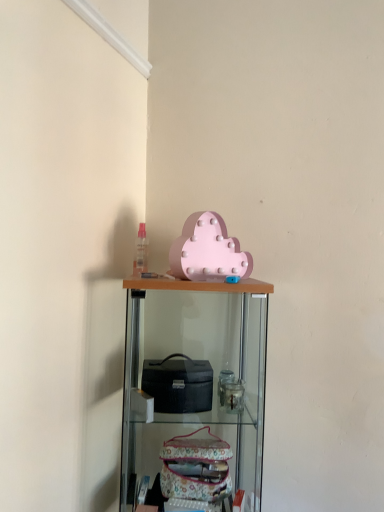
Question: Considering the relative positions of wooden shelf at center and matte pink cloud at upper center in the image provided, is wooden shelf at center to the right of matte pink cloud at upper center from the viewer's perspective?

Choices:
 (A) no
 (B) yes

Answer: (A)

Question: Is wooden shelf at center in contact with matte pink cloud at upper center?

Choices:
 (A) yes
 (B) no

Answer: (B)

Question: From a real-world perspective, is wooden shelf at center below matte pink cloud at upper center?

Choices:
 (A) no
 (B) yes

Answer: (B)

Question: Does wooden shelf at center have a larger size compared to matte pink cloud at upper center?

Choices:
 (A) no
 (B) yes

Answer: (B)

Question: From the image's perspective, is wooden shelf at center located beneath matte pink cloud at upper center?

Choices:
 (A) yes
 (B) no

Answer: (A)

Question: Does wooden shelf at center turn towards matte pink cloud at upper center?

Choices:
 (A) yes
 (B) no

Answer: (B)

Question: Is matte pink cloud at upper center not near wooden shelf at center?

Choices:
 (A) yes
 (B) no

Answer: (B)

Question: Is matte pink cloud at upper center smaller than wooden shelf at center?

Choices:
 (A) yes
 (B) no

Answer: (A)

Question: Considering the relative sizes of matte pink cloud at upper center and wooden shelf at center in the image provided, is matte pink cloud at upper center bigger than wooden shelf at center?

Choices:
 (A) no
 (B) yes

Answer: (A)

Question: Does matte pink cloud at upper center lie behind wooden shelf at center?

Choices:
 (A) no
 (B) yes

Answer: (B)

Question: Considering the relative positions of matte pink cloud at upper center and wooden shelf at center in the image provided, is matte pink cloud at upper center to the left of wooden shelf at center from the viewer's perspective?

Choices:
 (A) yes
 (B) no

Answer: (B)

Question: Does matte pink cloud at upper center have a lesser width compared to wooden shelf at center?

Choices:
 (A) no
 (B) yes

Answer: (B)

Question: Would you say matte pink cloud at upper center is to the left or to the right of wooden shelf at center in the picture?

Choices:
 (A) right
 (B) left

Answer: (A)